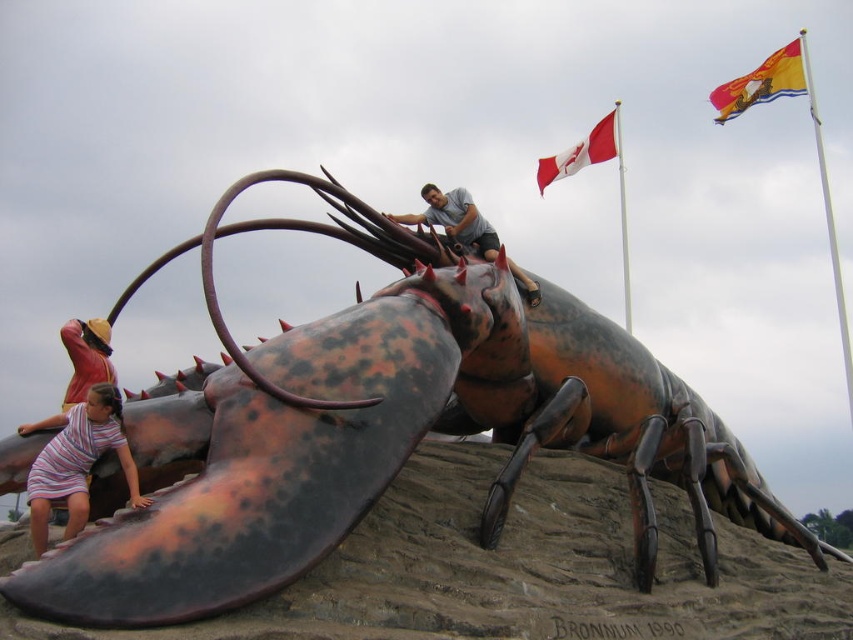
Is the position of reddish-brown leather hat at lower left more distant than that of red fabric flag at upper center?

That is False.

Is point (68, 326) more distant than point (577, 147)?

No, it is not.

The width and height of the screenshot is (853, 640). Find the location of `reddish-brown leather hat at lower left`. reddish-brown leather hat at lower left is located at coordinates (86, 356).

Find the location of `reddish-brown leather hat at lower left`. reddish-brown leather hat at lower left is located at coordinates (86, 356).

Does rustic metal lobster at center have a greater height compared to matte gray shirt at upper center?

Yes.

Is point (196, 433) closer to camera compared to point (518, 275)?

Yes, point (196, 433) is closer to viewer.

Between point (485, 540) and point (477, 212), which one is positioned behind?

Point (477, 212)

The width and height of the screenshot is (853, 640). Identify the location of rustic metal lobster at center. coord(383,429).

Identify the location of polyester flag at upper right. (763, 83).

The height and width of the screenshot is (640, 853). I want to click on polyester flag at upper right, so click(763, 83).